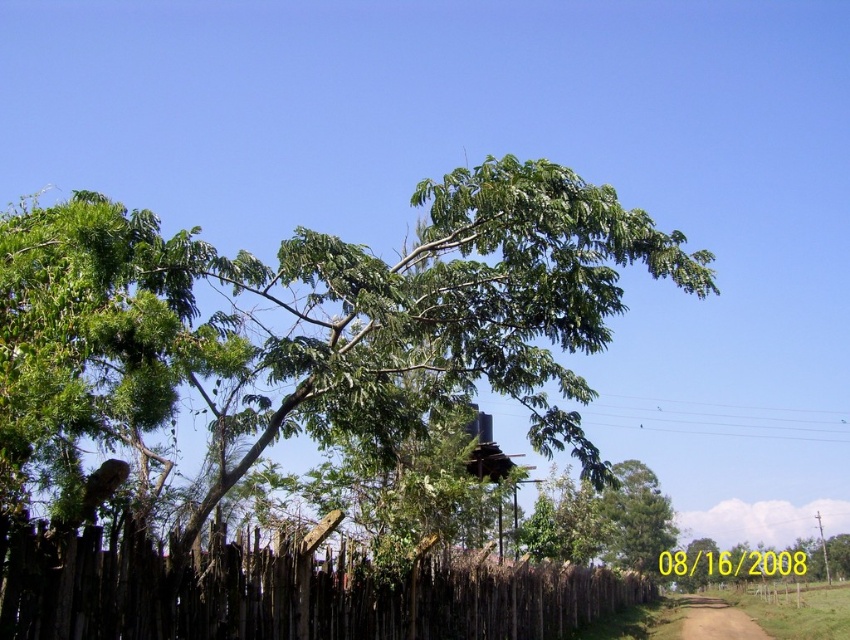
You are standing on the dirt path in the rural scene. You see the green leafy tree at center and the brown wooden fence at lower left. Which object is higher from the ground?

The green leafy tree at center is above the brown wooden fence at lower left, so it is higher from the ground.

You are a painter standing at the edge of the dirt path. You want to paint the green leafy tree at center and the brown wooden fence at lower left. If your canvas can only capture objects within a 5 meter range, will both fit on the same canvas?

The green leafy tree at center and brown wooden fence at lower left are 5.45 meters apart from each other. Since the distance between them exceeds the 5 meter range of your canvas, both cannot fit on the same canvas.